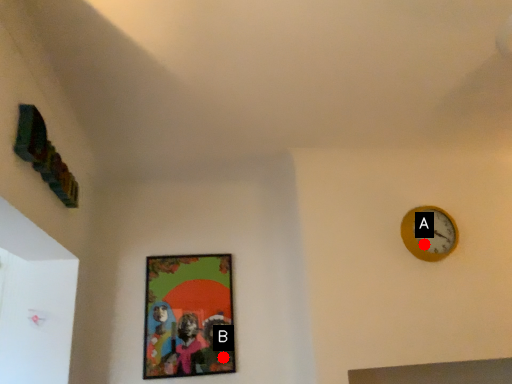
Question: Two points are circled on the image, labeled by A and B beside each circle. Which point appears farthest from the camera in this image?

Choices:
 (A) A is further
 (B) B is further

Answer: (B)